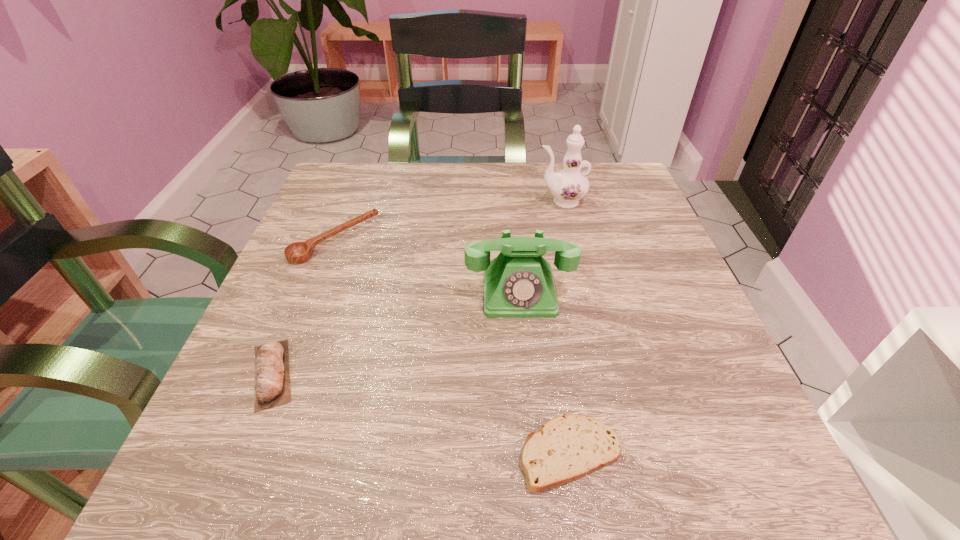
This screenshot has width=960, height=540. Identify the location of free space that satisfies the following two spatial constraints: 1. on the dial of the second tallest object; 2. on the right side of the shortest object. (535, 453).

This screenshot has height=540, width=960. I want to click on free space that satisfies the following two spatial constraints: 1. at the spout of the farthest object; 2. on the dial of the second tallest object, so click(583, 292).

Find the location of a particular element. Image resolution: width=960 pixels, height=540 pixels. vacant space that satisfies the following two spatial constraints: 1. at the spout of the chinaware; 2. on the front side of the wooden spoon is located at coordinates (570, 240).

Where is `free region that satisfies the following two spatial constraints: 1. at the spout of the chinaware; 2. on the dial of the second tallest object`? Image resolution: width=960 pixels, height=540 pixels. free region that satisfies the following two spatial constraints: 1. at the spout of the chinaware; 2. on the dial of the second tallest object is located at coordinates (583, 292).

Identify the location of vacant space that satisfies the following two spatial constraints: 1. at the spout of the chinaware; 2. on the dial of the telephone. (583, 292).

Find the location of a particular element. free space that satisfies the following two spatial constraints: 1. on the dial of the shortest object; 2. on the left side of the telephone is located at coordinates point(535,453).

Where is `free location that satisfies the following two spatial constraints: 1. on the dial of the nearer pita bread; 2. on the right side of the telephone`? The image size is (960, 540). free location that satisfies the following two spatial constraints: 1. on the dial of the nearer pita bread; 2. on the right side of the telephone is located at coordinates (535, 453).